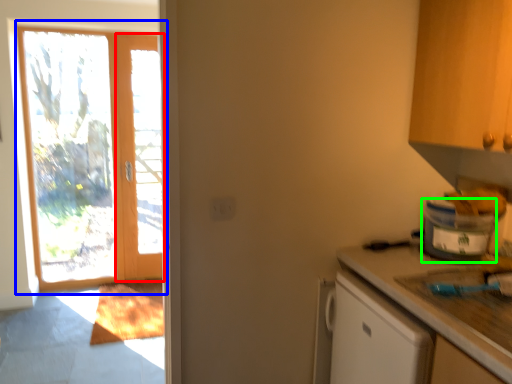
Question: Considering the real-world distances, which object is closest to screen door (highlighted by a red box)? door (highlighted by a blue box) or appliance (highlighted by a green box).

Choices:
 (A) door
 (B) appliance

Answer: (A)